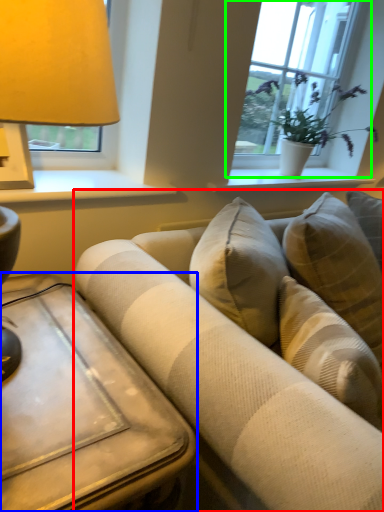
Question: Considering the real-world distances, which object is farthest from studio couch (highlighted by a red box)? table (highlighted by a blue box) or window (highlighted by a green box)?

Choices:
 (A) table
 (B) window

Answer: (B)